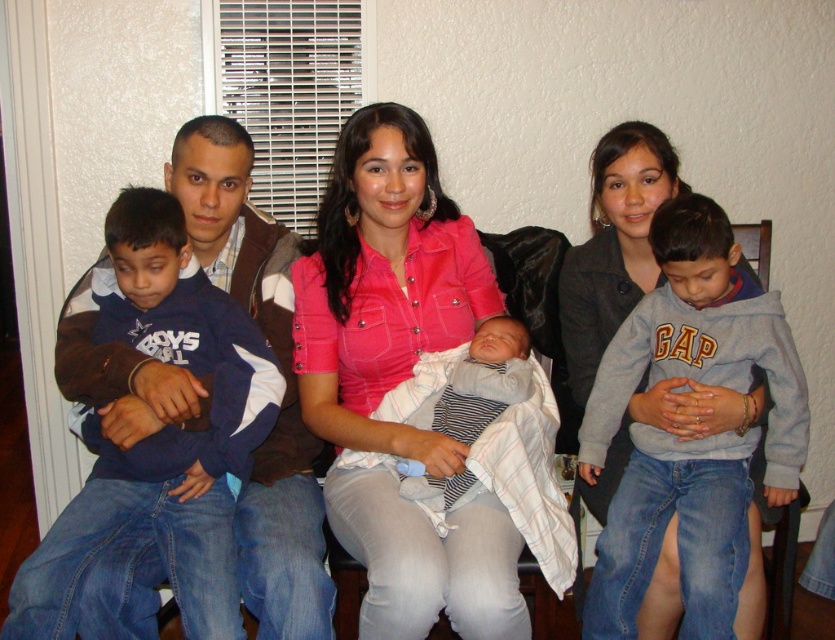
Question: Which object is the farthest from the brown textured jacket at left?

Choices:
 (A) striped knit sweater at center
 (B) pink denim shirt at center

Answer: (A)

Question: Among these points, which one is nearest to the camera?

Choices:
 (A) coord(223,131)
 (B) coord(618,275)
 (C) coord(419,198)

Answer: (A)

Question: Is pink denim shirt at center wider than brown textured jacket at left?

Choices:
 (A) yes
 (B) no

Answer: (B)

Question: Does pink fabric shirt at center appear on the right side of striped knit sweater at center?

Choices:
 (A) yes
 (B) no

Answer: (A)

Question: Which point is farther to the camera?

Choices:
 (A) (261, 548)
 (B) (453, 492)

Answer: (B)

Question: Observing the image, what is the correct spatial positioning of pink denim shirt at center in reference to pink fabric shirt at center?

Choices:
 (A) above
 (B) below

Answer: (B)